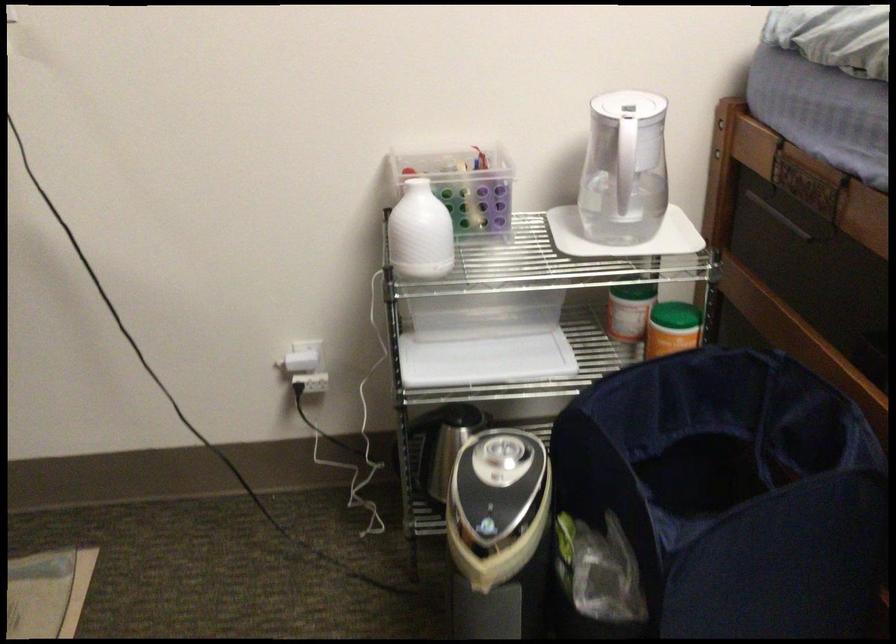
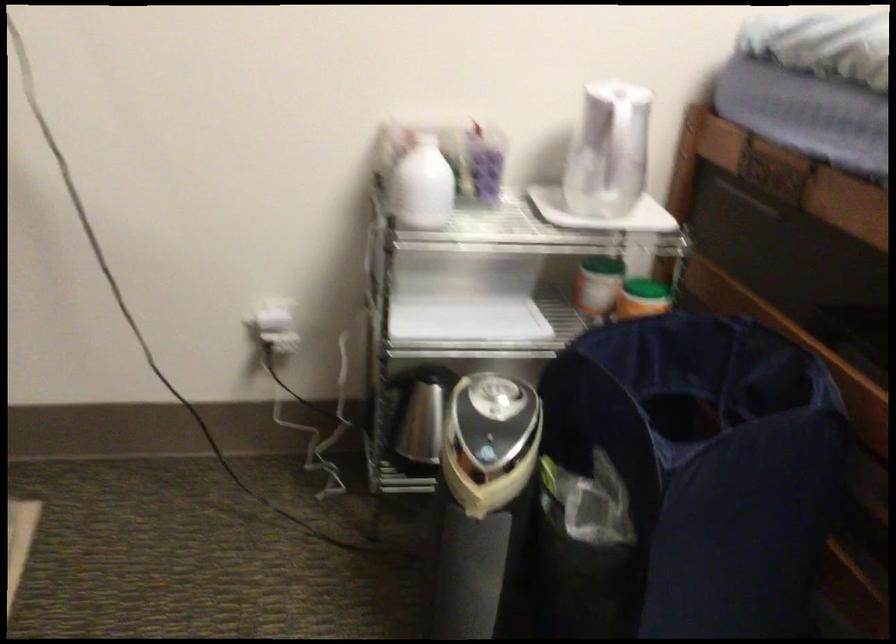
In the second image, find the point that corresponds to point (486, 527) in the first image.

(486, 453)